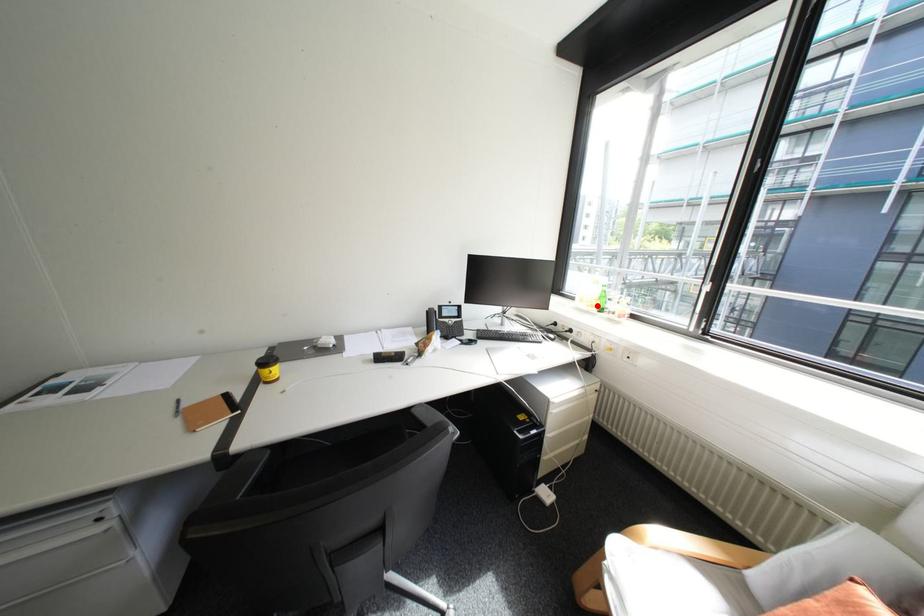
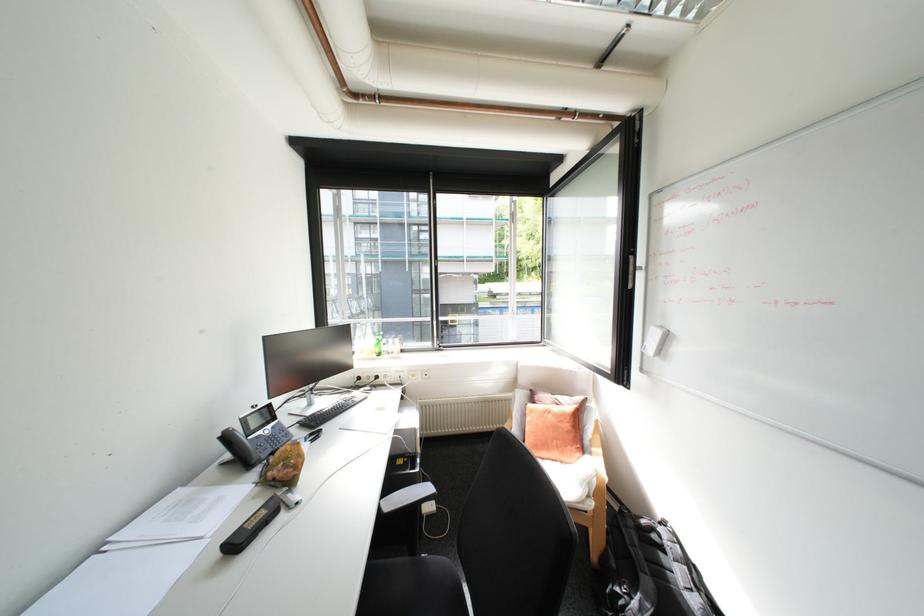
Locate, in the second image, the point that corresponds to the highlighted location in the first image.

(379, 354)